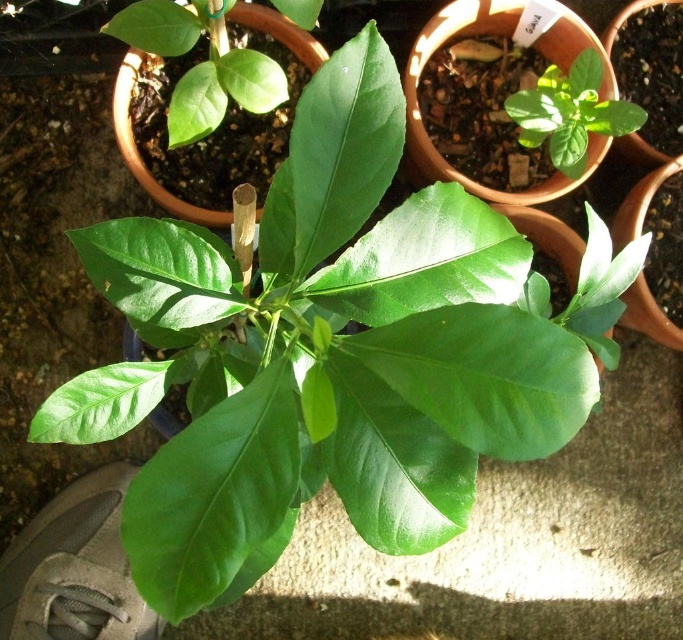
Is glossy green leaf at upper left below green matte leaf at upper right?

Indeed, glossy green leaf at upper left is positioned under green matte leaf at upper right.

Between glossy green leaf at upper left and green matte leaf at upper right, which one has more height?

green matte leaf at upper right

In order to click on glossy green leaf at upper left in this screenshot , I will do `click(223, 83)`.